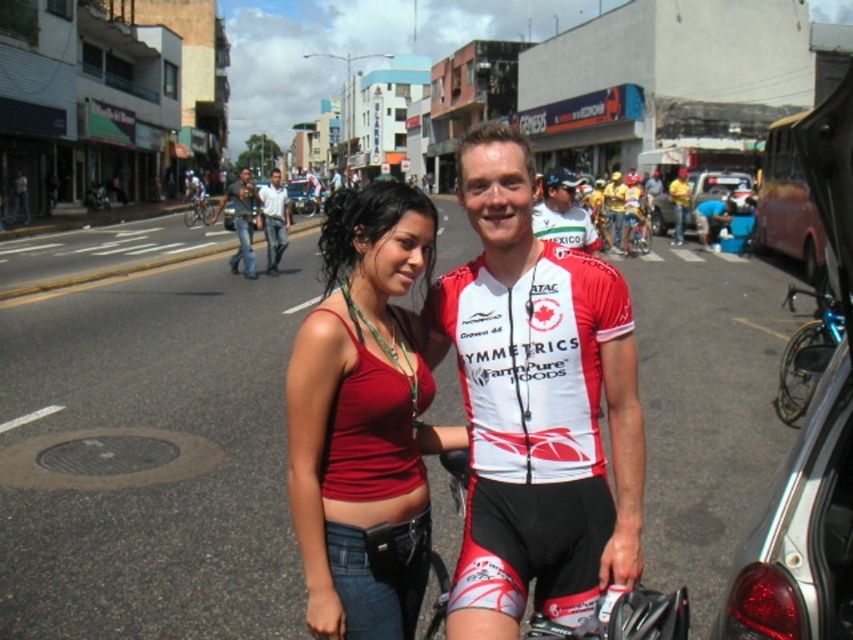
Question: Which point is farther from the camera taking this photo?

Choices:
 (A) (248, 211)
 (B) (624, 241)
 (C) (733, 630)

Answer: (B)

Question: Which object is closer to the camera taking this photo?

Choices:
 (A) matte red tank top at center
 (B) dark gray jeans at center

Answer: (A)

Question: Which object appears closest to the camera in this image?

Choices:
 (A) black matte bicycle helmet at center
 (B) matte red tank top at center

Answer: (B)

Question: Does matte red tank top at center lie in front of yellow fabric shirt at center?

Choices:
 (A) yes
 (B) no

Answer: (A)

Question: Does shiny metallic bicycle at right appear under metallic silver car at center?

Choices:
 (A) yes
 (B) no

Answer: (A)

Question: Can you confirm if dark gray jeans at center is thinner than black matte bicycle helmet at center?

Choices:
 (A) yes
 (B) no

Answer: (B)